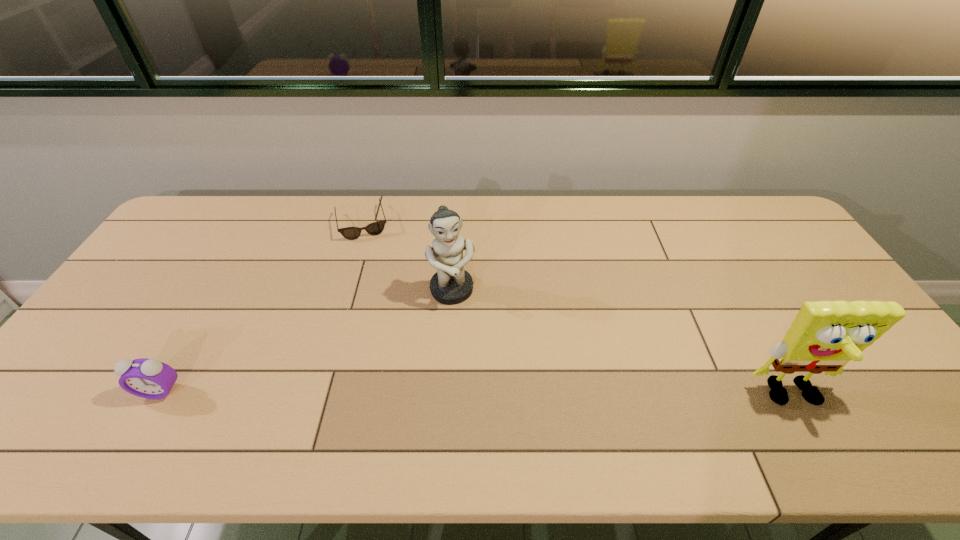
The image size is (960, 540). In order to click on alarm clock in this screenshot , I will do pos(147,378).

At what (x,y) coordinates should I click in order to perform the action: click on the leftmost object. Please return your answer as a coordinate pair (x, y). This screenshot has width=960, height=540. Looking at the image, I should click on (147, 378).

This screenshot has height=540, width=960. In order to click on the rightmost object in this screenshot , I will do `click(825, 335)`.

Where is `the second object from right to left`? Image resolution: width=960 pixels, height=540 pixels. the second object from right to left is located at coordinates (451, 284).

This screenshot has height=540, width=960. In order to click on the second farthest object in this screenshot , I will do point(451,284).

The width and height of the screenshot is (960, 540). I want to click on sunglasses, so click(x=351, y=233).

At what (x,y) coordinates should I click in order to perform the action: click on the shortest object. Please return your answer as a coordinate pair (x, y). Looking at the image, I should click on (351, 233).

I want to click on free space located 0.090m on the front-facing side of the second object from right to left, so click(462, 334).

Find the location of `blank space located on the front-facing side of the second object from right to left`. blank space located on the front-facing side of the second object from right to left is located at coordinates pyautogui.click(x=469, y=365).

This screenshot has width=960, height=540. Identify the location of vacant space located on the front-facing side of the second object from right to left. 465,346.